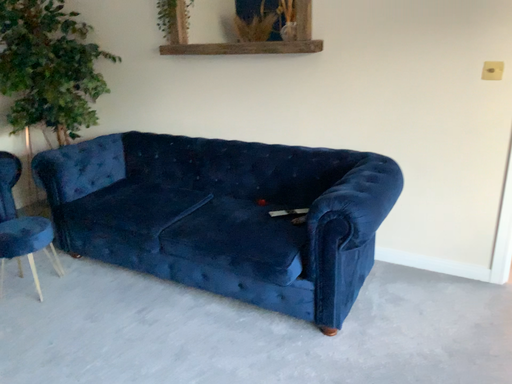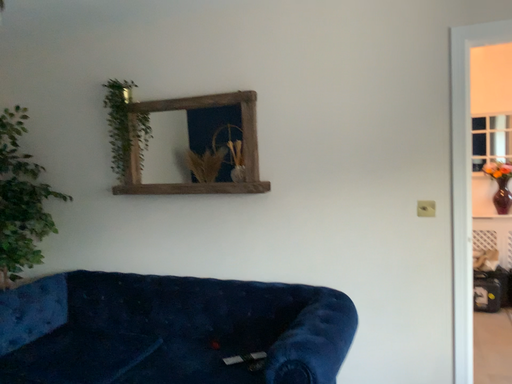
Question: Which way did the camera rotate in the video?

Choices:
 (A) rotated upward
 (B) rotated downward

Answer: (A)